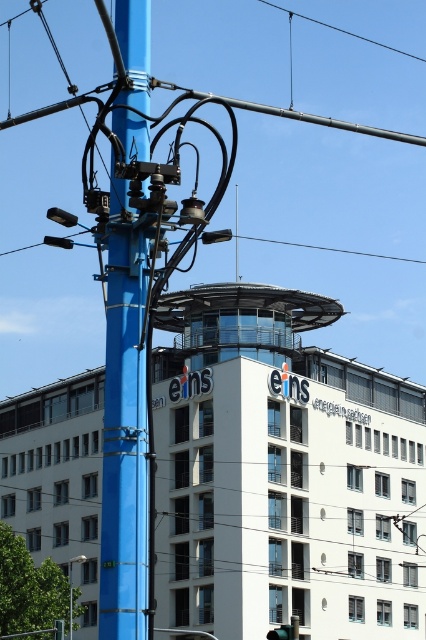
Question: Which object is positioned closest to the blue metallic pole at lower left?

Choices:
 (A) green matte traffic light at center
 (B) blue painted metal pole at center

Answer: (A)

Question: Which is nearer to the blue painted metal pole at center?

Choices:
 (A) green matte traffic light at center
 (B) blue metallic pole at lower left

Answer: (A)

Question: Does blue painted metal pole at center have a larger size compared to green matte traffic light at center?

Choices:
 (A) no
 (B) yes

Answer: (A)

Question: Does blue painted metal pole at center appear on the left side of blue metallic pole at lower left?

Choices:
 (A) yes
 (B) no

Answer: (B)

Question: Is blue painted metal pole at center below green matte traffic light at center?

Choices:
 (A) yes
 (B) no

Answer: (B)

Question: Among these points, which one is nearest to the camera?

Choices:
 (A) (112, 161)
 (B) (71, 611)
 (C) (290, 636)

Answer: (A)